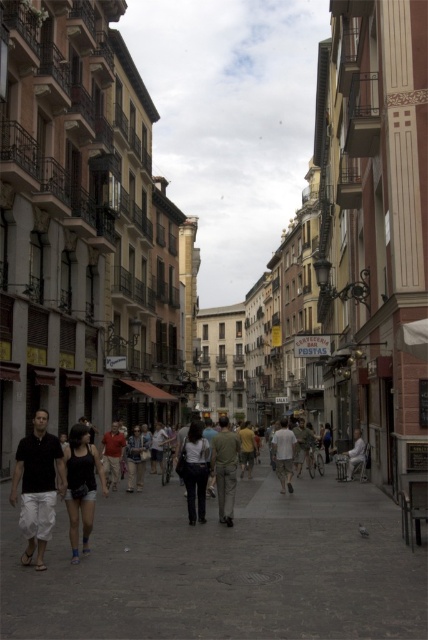
Does matte black shirt at center have a lesser width compared to white cotton pants at center?

Yes.

Does matte black shirt at center appear on the right side of white cotton pants at center?

Incorrect, matte black shirt at center is not on the right side of white cotton pants at center.

Which is in front, point (42, 516) or point (196, 464)?

Point (42, 516) is more forward.

The image size is (428, 640). I want to click on matte black shirt at center, so click(38, 486).

Who is positioned more to the right, dark gray pants at center or light beige pants at center?

From the viewer's perspective, light beige pants at center appears more on the right side.

Can you confirm if dark gray pants at center is thinner than light beige pants at center?

In fact, dark gray pants at center might be wider than light beige pants at center.

Measure the distance between dark gray pants at center and camera.

dark gray pants at center is 43.75 meters from camera.

At what (x,y) coordinates should I click in order to perform the action: click on dark gray pants at center. Please return your answer as a coordinate pair (x, y). Looking at the image, I should click on (15, 481).

Between point (231, 436) and point (287, 445), which one is positioned behind?

The point (287, 445) is behind.

Does point (237, 454) come in front of point (285, 483)?

Yes, point (237, 454) is in front of point (285, 483).

Which is in front, point (217, 488) or point (288, 472)?

Point (217, 488)

Where is `khaki pants at center`? The image size is (428, 640). khaki pants at center is located at coordinates (225, 468).